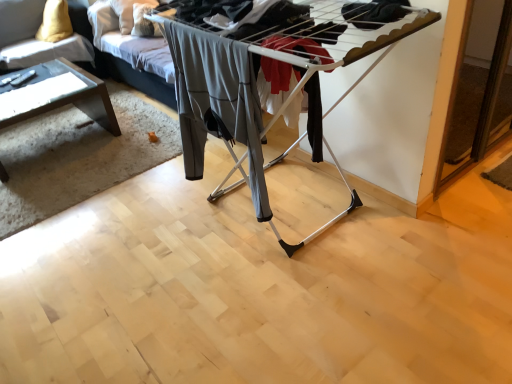
Question: Is velvet yellow pillow at upper left taller than gray fabric pants at center?

Choices:
 (A) no
 (B) yes

Answer: (A)

Question: From a real-world perspective, is velvet yellow pillow at upper left positioned over gray fabric pants at center based on gravity?

Choices:
 (A) no
 (B) yes

Answer: (A)

Question: Considering the relative sizes of velvet yellow pillow at upper left and gray fabric pants at center in the image provided, is velvet yellow pillow at upper left shorter than gray fabric pants at center?

Choices:
 (A) yes
 (B) no

Answer: (A)

Question: Considering the relative positions of velvet yellow pillow at upper left and gray fabric pants at center in the image provided, is velvet yellow pillow at upper left behind gray fabric pants at center?

Choices:
 (A) no
 (B) yes

Answer: (B)

Question: Can you confirm if velvet yellow pillow at upper left is thinner than gray fabric pants at center?

Choices:
 (A) yes
 (B) no

Answer: (B)

Question: Could gray fabric pants at center be considered to be inside velvet yellow pillow at upper left?

Choices:
 (A) no
 (B) yes

Answer: (A)

Question: From the image's perspective, does gray fabric pants at center appear higher than clear glass table at left?

Choices:
 (A) yes
 (B) no

Answer: (B)

Question: From a real-world perspective, is gray fabric pants at center positioned over clear glass table at left based on gravity?

Choices:
 (A) no
 (B) yes

Answer: (B)

Question: Is gray fabric pants at center directly adjacent to clear glass table at left?

Choices:
 (A) no
 (B) yes

Answer: (A)

Question: Does gray fabric pants at center have a smaller size compared to clear glass table at left?

Choices:
 (A) no
 (B) yes

Answer: (B)

Question: Considering the relative sizes of gray fabric pants at center and clear glass table at left in the image provided, is gray fabric pants at center taller than clear glass table at left?

Choices:
 (A) no
 (B) yes

Answer: (B)

Question: Does gray fabric pants at center come in front of clear glass table at left?

Choices:
 (A) no
 (B) yes

Answer: (B)

Question: Does velvet yellow pillow at upper left have a lesser width compared to clear glass table at left?

Choices:
 (A) no
 (B) yes

Answer: (B)